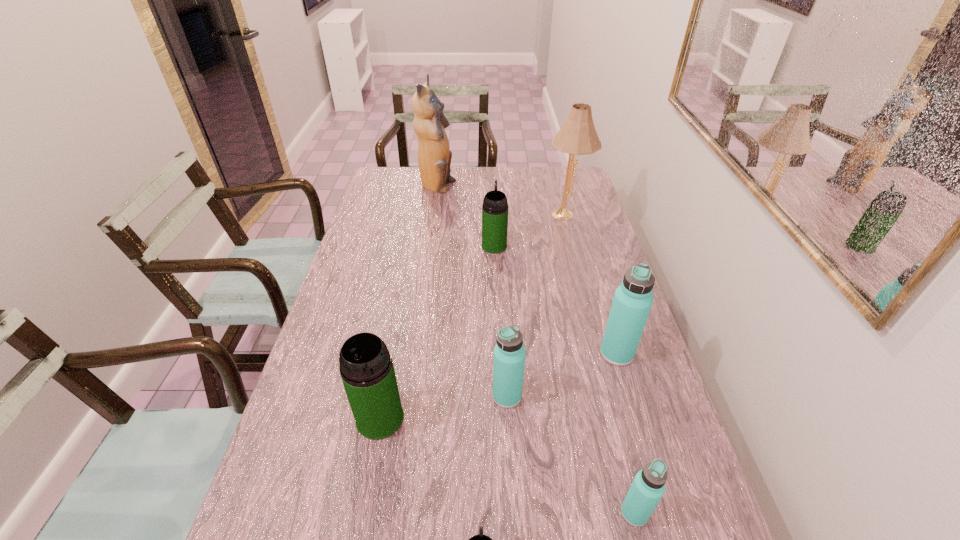
Find the location of a particular element. The height and width of the screenshot is (540, 960). unoccupied position between the second farthest thermos bottle and the smallest aqua thermos bottle is located at coordinates (626, 433).

This screenshot has height=540, width=960. Find the location of `free spot between the leftmost green thermos bottle and the leftmost aqua thermos bottle`. free spot between the leftmost green thermos bottle and the leftmost aqua thermos bottle is located at coordinates click(x=444, y=407).

At what (x,y) coordinates should I click in order to perform the action: click on free point between the second nearest object and the cat. Please return your answer as a coordinate pair (x, y). Looking at the image, I should click on (536, 350).

I want to click on vacant space that's between the fifth nearest object and the second farthest object, so click(591, 284).

You are a GUI agent. You are given a task and a screenshot of the screen. Output one action in this format:
    pyautogui.click(x=<x>, y=<y>)
    Task: Click on the blank region between the second farthest aqua thermos bottle and the smallest aqua thermos bottle
    This screenshot has width=960, height=540.
    Given the screenshot: What is the action you would take?
    (570, 455)

The height and width of the screenshot is (540, 960). Find the location of `the closest object to the nearest object`. the closest object to the nearest object is located at coordinates (648, 486).

Select which object is the seventh closest to the nearest green thermos bottle. Please provide its 2D coordinates. Your answer should be formatted as a tuple, i.e. [(x, y)], where the tuple contains the x and y coordinates of a point satisfying the conditions above.

[(434, 156)]

You are a GUI agent. You are given a task and a screenshot of the screen. Output one action in this format:
    pyautogui.click(x=<x>, y=<y>)
    Task: Click on the thermos bottle object that ranks as the closest to the second nearest aqua thermos bottle
    
    Given the screenshot: What is the action you would take?
    pyautogui.click(x=366, y=367)

The width and height of the screenshot is (960, 540). I want to click on the third closest thermos bottle relative to the farthest thermos bottle, so click(366, 367).

This screenshot has height=540, width=960. Find the location of `green thermos bottle that is the closest one to the leftmost green thermos bottle`. green thermos bottle that is the closest one to the leftmost green thermos bottle is located at coordinates (480, 539).